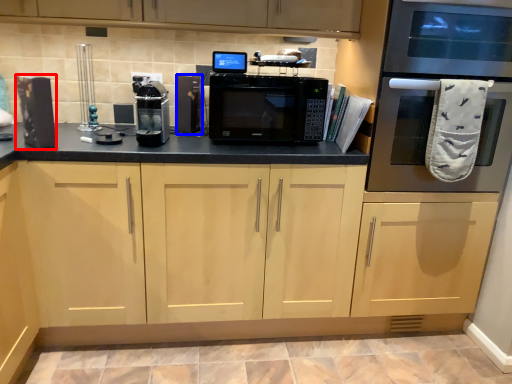
Question: Which of the following is the farthest to the observer, appliance (highlighted by a red box) or appliance (highlighted by a blue box)?

Choices:
 (A) appliance
 (B) appliance

Answer: (B)